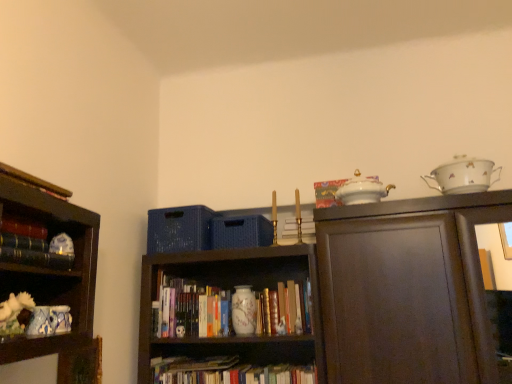
Question: Is point (382, 193) closer or farther from the camera than point (287, 288)?

Choices:
 (A) farther
 (B) closer

Answer: (B)

Question: Is white porcelain teapot at upper center spatially inside hardcover book at center, which appears as the second book when viewed from the back, or outside of it?

Choices:
 (A) inside
 (B) outside

Answer: (B)

Question: Based on their relative distances, which object is nearer to the white porcelain teapot at upper center?

Choices:
 (A) hardcover book at center, which ranks as the 3th book in left-to-right order
 (B) white porcelain tea set at upper right
 (C) hardcover books at center, the 3th book in the front-to-back sequence
 (D) matte black book at left, the first book viewed from the front

Answer: (B)

Question: Which object is the closest to the hardcover book at center, the 2th book viewed from the top?

Choices:
 (A) matte black book at left, which is the first book from top to bottom
 (B) hardcover books at center, the 1th book ordered from the bottom
 (C) white porcelain teapot at upper center
 (D) white porcelain tea set at upper right

Answer: (B)